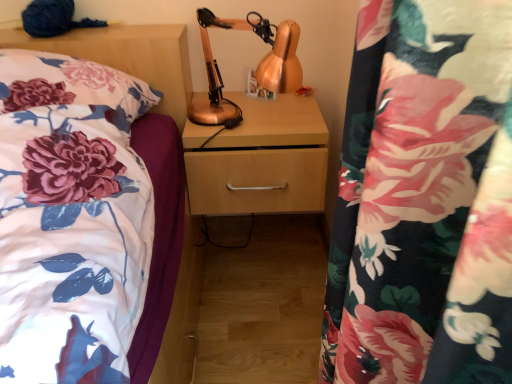
Find the location of a particular element. The height and width of the screenshot is (384, 512). blank area beneath copper metallic table lamp at center (from a real-world perspective) is located at coordinates (254, 124).